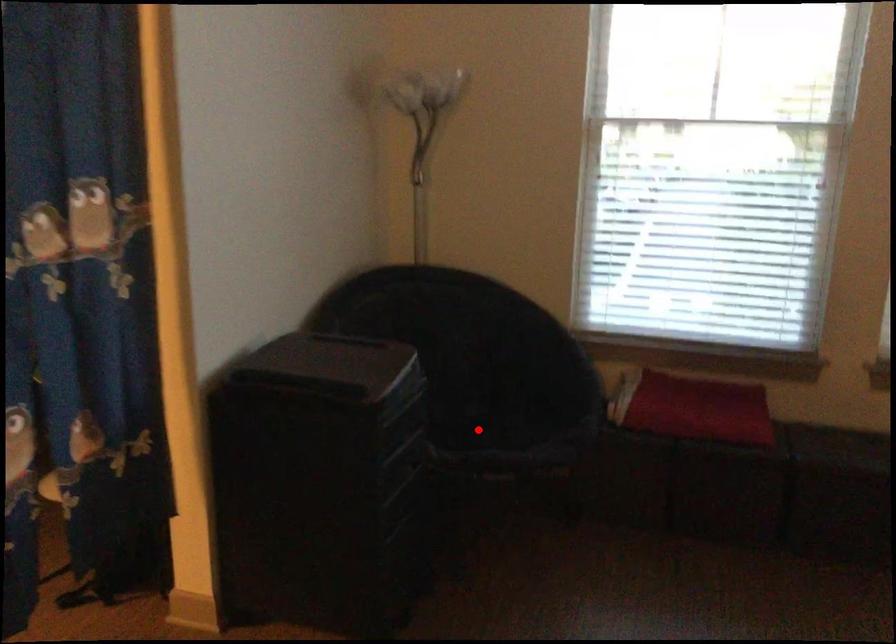
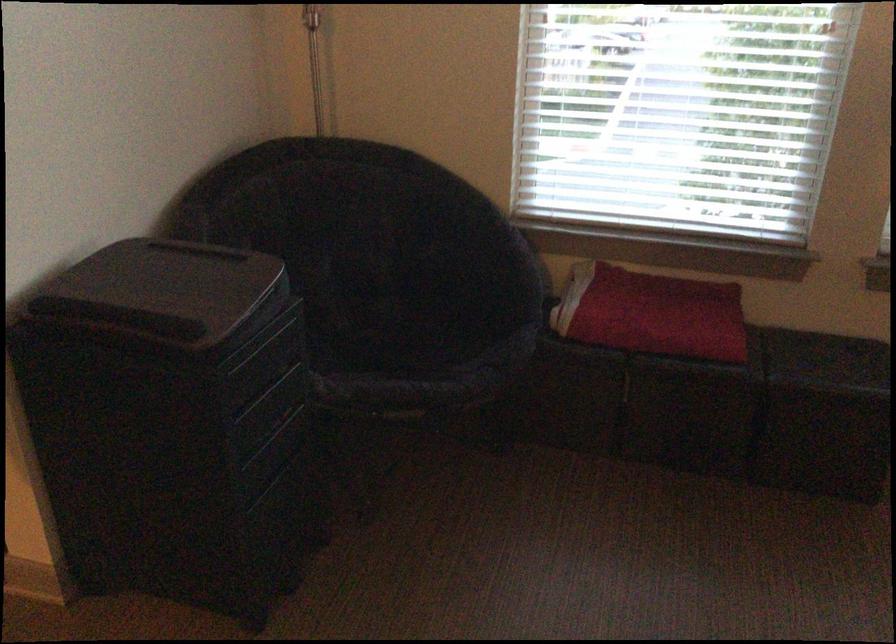
Locate, in the second image, the point that corresponds to the highlighted location in the first image.

(393, 339)